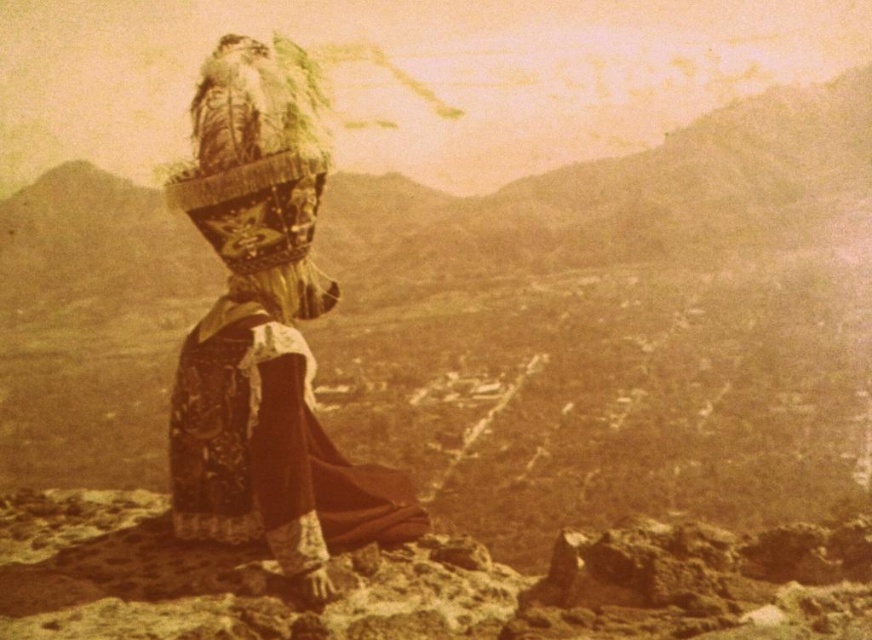
Question: Which of the following is the closest to the observer?

Choices:
 (A) (307, 572)
 (B) (365, 532)
 (C) (276, 109)

Answer: (A)

Question: Where is velvet maroon dress at center located in relation to fuzzy fur headdress at center in the image?

Choices:
 (A) above
 (B) below

Answer: (B)

Question: Can you confirm if matte brown dress at center is bigger than fuzzy fur headdress at center?

Choices:
 (A) no
 (B) yes

Answer: (B)

Question: Which point is closer to the camera taking this photo?

Choices:
 (A) (257, 454)
 (B) (295, 248)

Answer: (A)

Question: In this image, where is matte brown dress at center located relative to velvet maroon dress at center?

Choices:
 (A) above
 (B) below

Answer: (A)

Question: Considering the real-world distances, which object is farthest from the matte brown dress at center?

Choices:
 (A) fuzzy fur headdress at center
 (B) velvet maroon dress at center

Answer: (A)